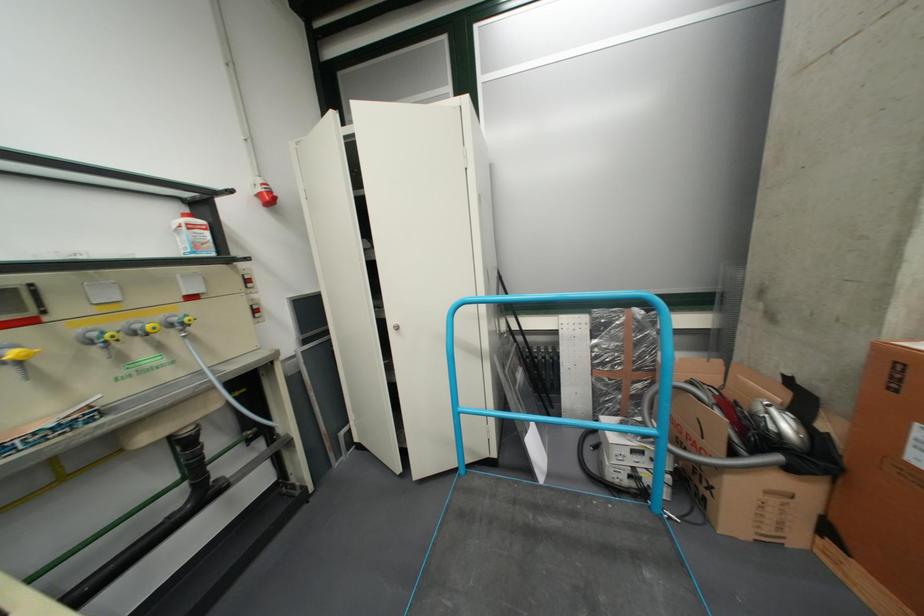
Where is `yellow valve handle`? This screenshot has width=924, height=616. yellow valve handle is located at coordinates coord(17,354).